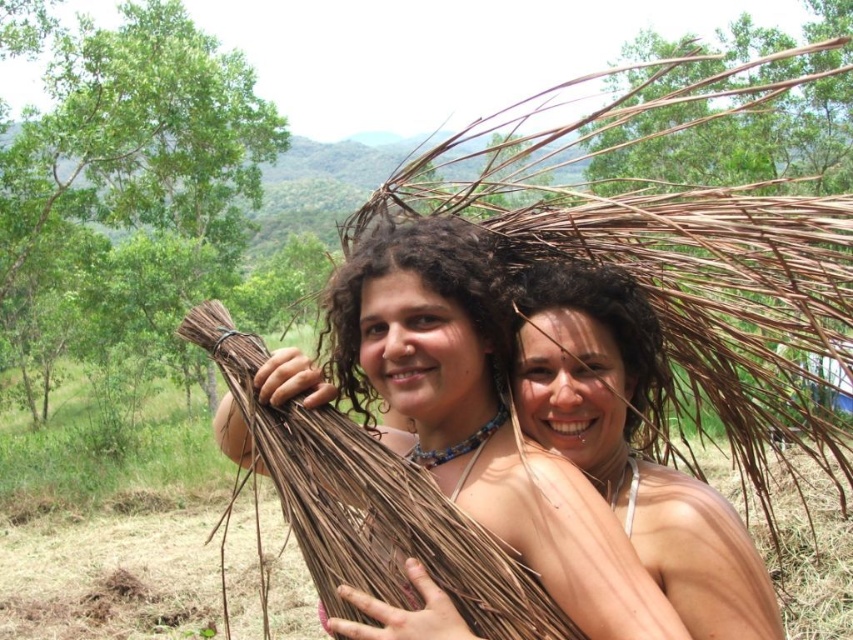
Can you confirm if brown natural hair at center is positioned below dark brown hair at center?

Yes.

Does brown natural hair at center appear over dark brown hair at center?

No, brown natural hair at center is not above dark brown hair at center.

Does point (628, 333) come in front of point (622, 276)?

That is True.

This screenshot has width=853, height=640. I want to click on brown natural hair at center, so click(x=628, y=442).

Which is above, brown natural fiber bundle at center or dark brown hair at center?

dark brown hair at center is higher up.

Identify the location of brown natural fiber bundle at center. (527, 449).

Describe the element at coordinates (527, 449) in the screenshot. The height and width of the screenshot is (640, 853). I see `brown natural fiber bundle at center` at that location.

In order to click on brown natural fiber bundle at center in this screenshot , I will do `click(527, 449)`.

Can you confirm if dark curly hair at center is wider than dark brown hair at center?

No.

Is the position of dark curly hair at center more distant than that of dark brown hair at center?

No, it is in front of dark brown hair at center.

The height and width of the screenshot is (640, 853). In order to click on dark curly hair at center in this screenshot , I will do `click(426, 284)`.